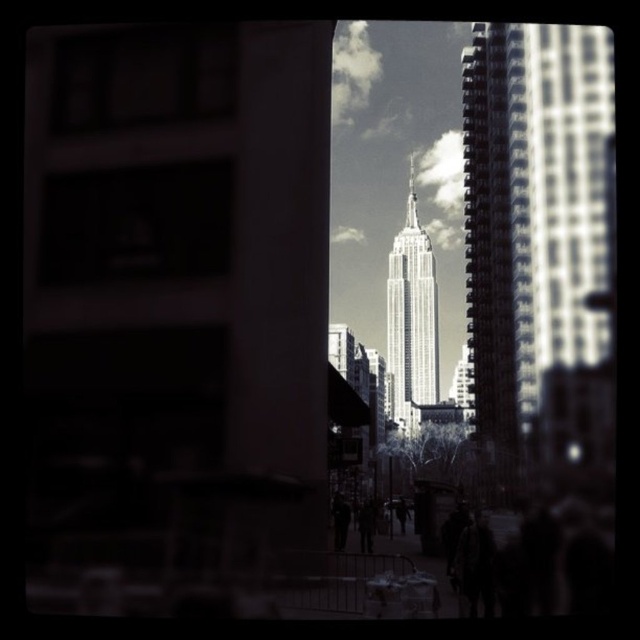
Question: Which point is farther to the camera?

Choices:
 (A) dark clothing at center
 (B) white glass tower at center
 (C) dark gray pants at center
 (D) dark brown leather jacket at lower center

Answer: (B)

Question: Which point is farther to the camera?

Choices:
 (A) smooth glass skyscraper at center
 (B) dark brown leather jacket at lower center
 (C) white glass tower at center
 (D) dark fabric coat at center

Answer: (C)

Question: Does white glass tower at center appear on the left side of dark gray pants at center?

Choices:
 (A) yes
 (B) no

Answer: (B)

Question: Which point is closer to the camera taking this photo?

Choices:
 (A) (333, 525)
 (B) (524, 332)

Answer: (A)

Question: Is dark brown leather jacket at lower center positioned in front of dark fabric coat at center?

Choices:
 (A) no
 (B) yes

Answer: (B)

Question: Can you confirm if dark brown leather jacket at lower center is positioned below dark fabric coat at center?

Choices:
 (A) yes
 (B) no

Answer: (A)